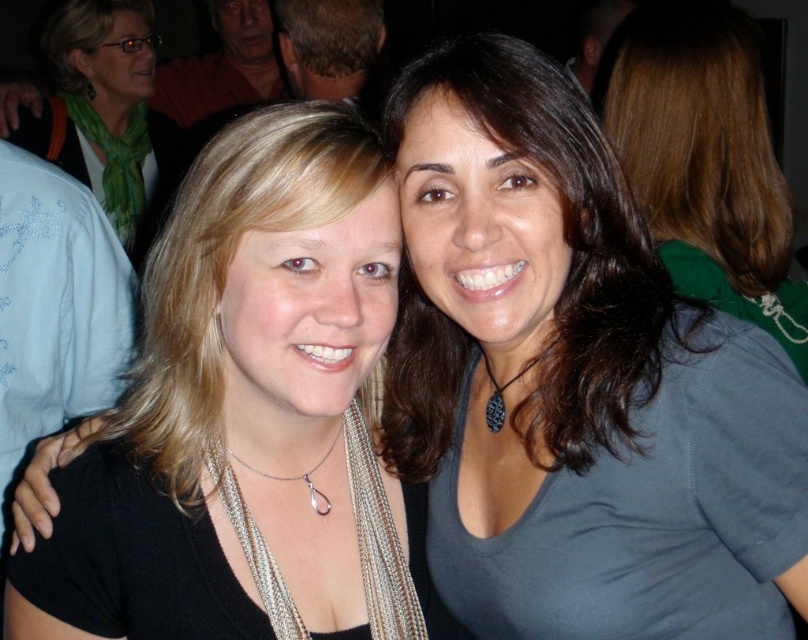
Question: Which of the following is the farthest from the observer?

Choices:
 (A) dark brown hair at center
 (B) green scarf at upper left

Answer: (B)

Question: Does brown hair at upper center appear on the right side of black beaded necklace at center?

Choices:
 (A) no
 (B) yes

Answer: (B)

Question: Which of the following is the closest to the observer?

Choices:
 (A) (213, 195)
 (B) (747, 38)
 (C) (487, 376)
 (D) (558, 634)

Answer: (A)

Question: In this image, where is green scarf at upper left located relative to black beaded necklace at center?

Choices:
 (A) right
 (B) left

Answer: (B)

Question: Which of the following is the closest to the observer?

Choices:
 (A) dark brown hair at center
 (B) brown hair at upper center
 (C) silver/pearl necklace at center
 (D) black beaded necklace at center

Answer: (A)

Question: Does green scarf at upper left appear on the right side of silver/pearl necklace at center?

Choices:
 (A) yes
 (B) no

Answer: (B)